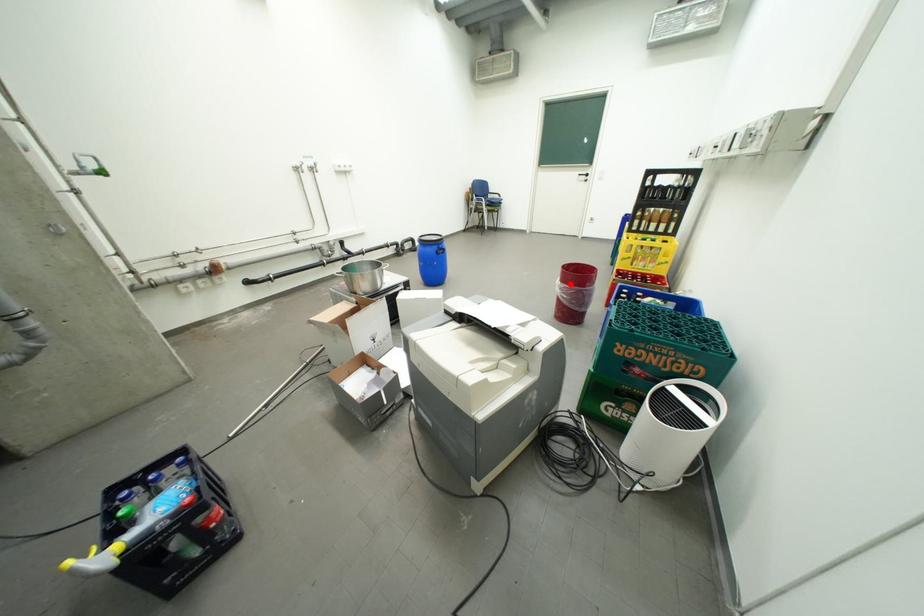
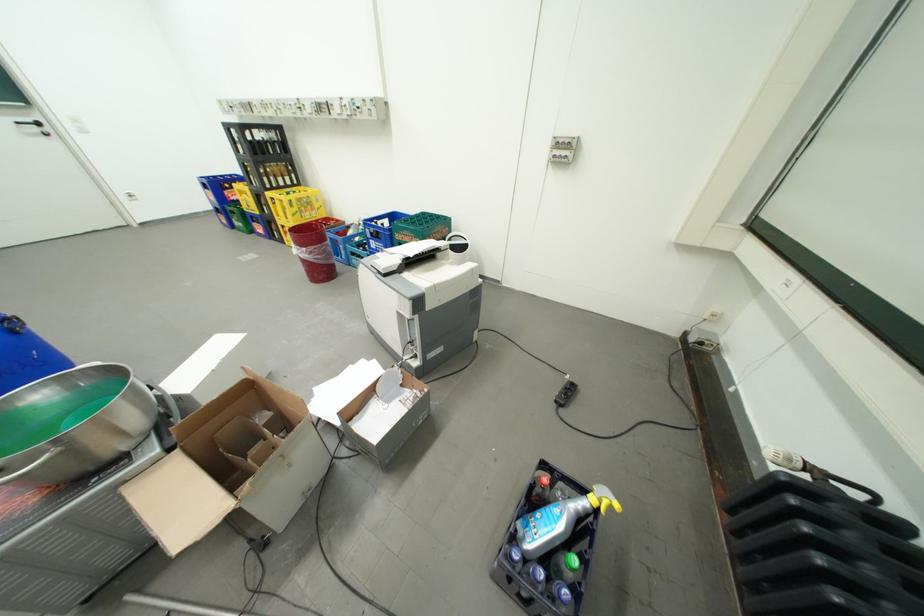
Question: A red point is marked in image1. In image2, is the corresponding 3D point closer to the camera or farther? Reply with the corresponding letter.

Choices:
 (A) The corresponding 3D point is closer.
 (B) The corresponding 3D point is farther.

Answer: (A)